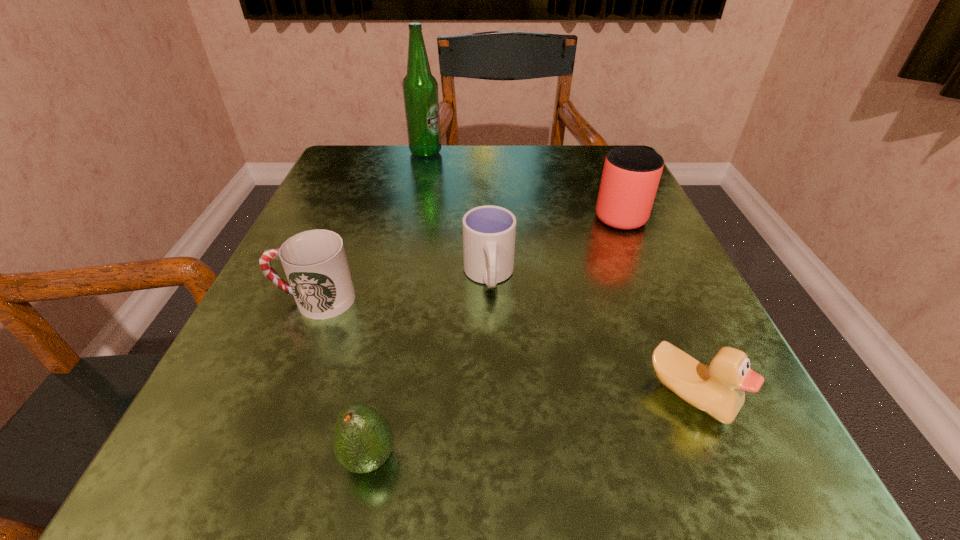
The image size is (960, 540). I want to click on unoccupied position between the duck and the avocado, so click(530, 427).

Where is `free space between the duck and the avocado`? The height and width of the screenshot is (540, 960). free space between the duck and the avocado is located at coordinates (530, 427).

At what (x,y) coordinates should I click in order to perform the action: click on free area in between the farthest cup and the fourth object from left to right. Please return your answer as a coordinate pair (x, y). The image size is (960, 540). Looking at the image, I should click on (553, 244).

Where is `vacant area that lies between the tallest cup and the farthest object`? Image resolution: width=960 pixels, height=540 pixels. vacant area that lies between the tallest cup and the farthest object is located at coordinates (522, 183).

Locate an element on the screen. The width and height of the screenshot is (960, 540). free area in between the tallest object and the nearest object is located at coordinates (397, 306).

The image size is (960, 540). Identify the location of free space between the fifth farthest object and the third object from right to left. (589, 335).

Identify the location of vacant space that is in between the fifth nearest object and the tallest object. (522, 183).

Identify which object is the fourth nearest to the second cup from left to right. Please provide its 2D coordinates. Your answer should be formatted as a tuple, i.e. [(x, y)], where the tuple contains the x and y coordinates of a point satisfying the conditions above.

[(363, 440)]

You are a GUI agent. You are given a task and a screenshot of the screen. Output one action in this format:
    pyautogui.click(x=<x>, y=<y>)
    Task: Click on the object that is the closest to the fifth farthest object
    The height and width of the screenshot is (540, 960).
    Given the screenshot: What is the action you would take?
    pyautogui.click(x=489, y=232)

Select which cup appears as the closest to the second cup from left to right. Please provide its 2D coordinates. Your answer should be formatted as a tuple, i.e. [(x, y)], where the tuple contains the x and y coordinates of a point satisfying the conditions above.

[(315, 263)]